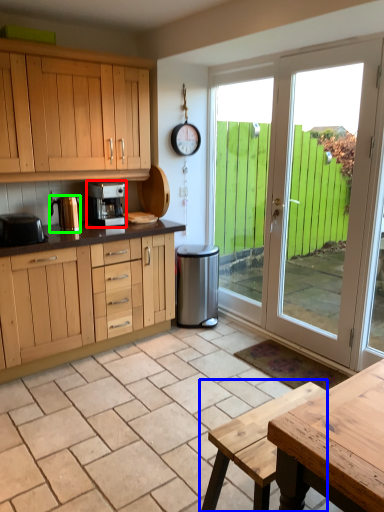
Question: Which is farther away from kitchen appliance (highlighted by a red box)? picnic table (highlighted by a blue box) or appliance (highlighted by a green box)?

Choices:
 (A) picnic table
 (B) appliance

Answer: (A)